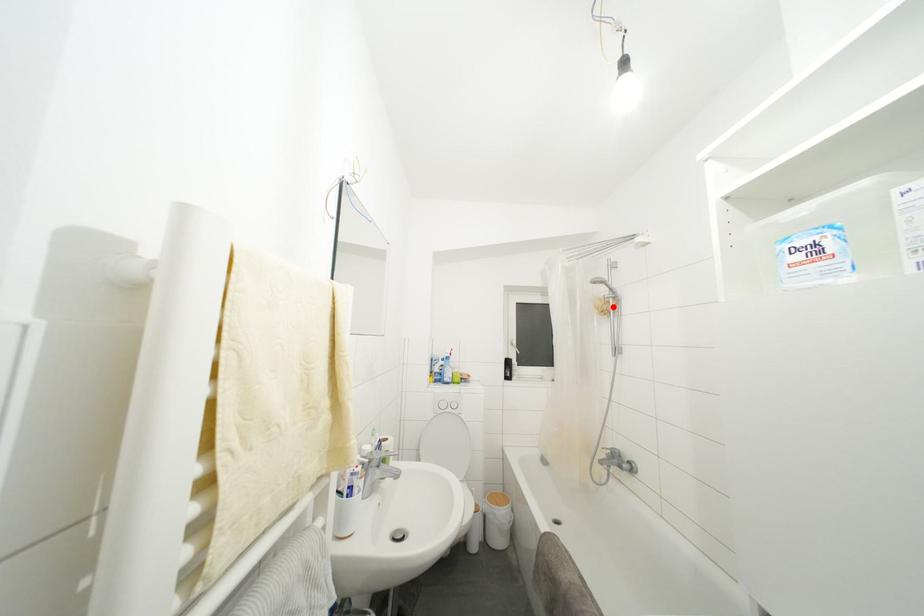
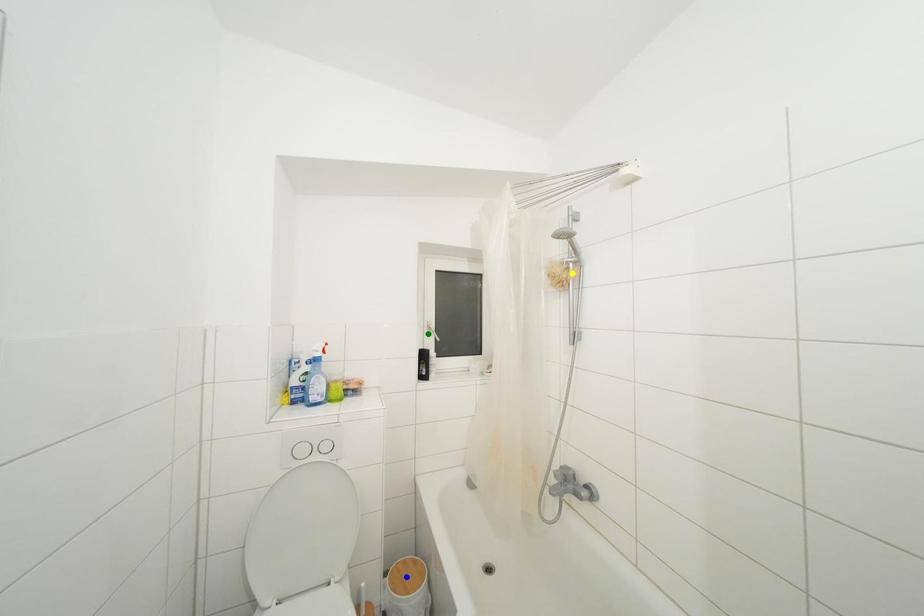
Question: I am providing you with two images of the same scene from different viewpoints. A red point is marked on the first image. You are given multiple points on the second image. Which mark in image 2 goes with the point in image 1?

Choices:
 (A) blue point
 (B) yellow point
 (C) green point

Answer: (B)